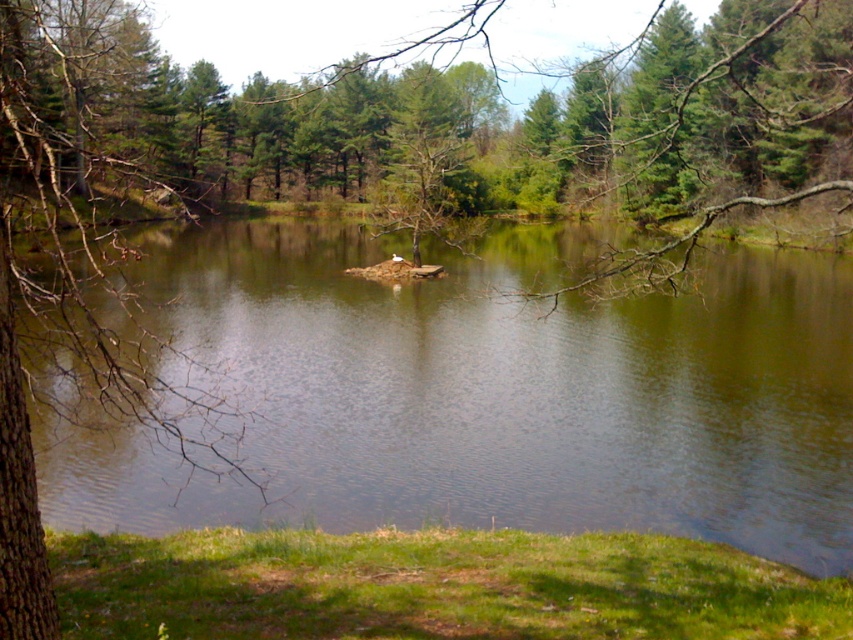
Question: Which point is farther to the camera?

Choices:
 (A) (447, 339)
 (B) (25, 99)

Answer: (A)

Question: Is green reflective water at center positioned behind brown bark tree at left?

Choices:
 (A) no
 (B) yes

Answer: (B)

Question: Is green reflective water at center bigger than brown bark tree at left?

Choices:
 (A) no
 (B) yes

Answer: (A)

Question: Which of the following is the closest to the observer?

Choices:
 (A) (90, 125)
 (B) (705, 468)

Answer: (B)

Question: In this image, where is green reflective water at center located relative to brown bark tree at left?

Choices:
 (A) below
 (B) above

Answer: (A)